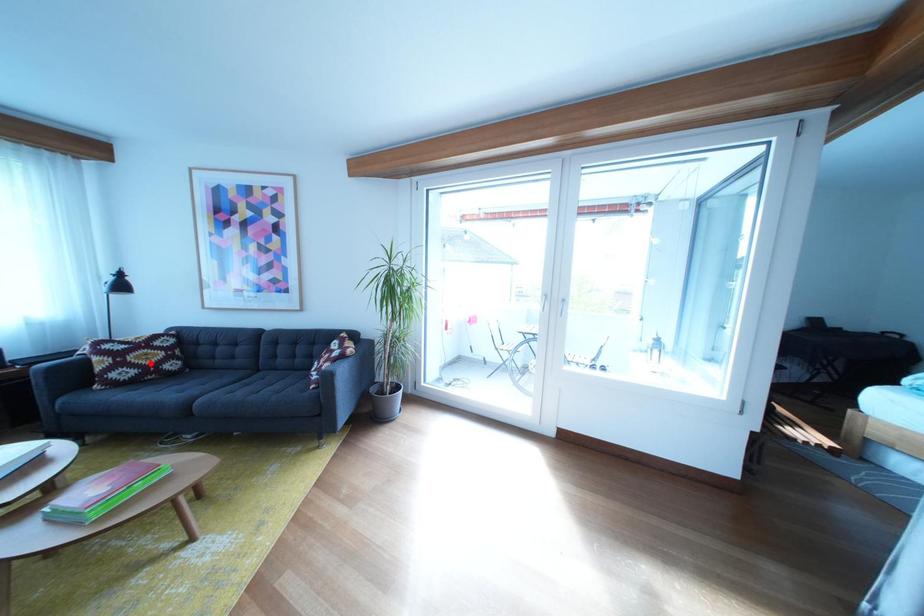
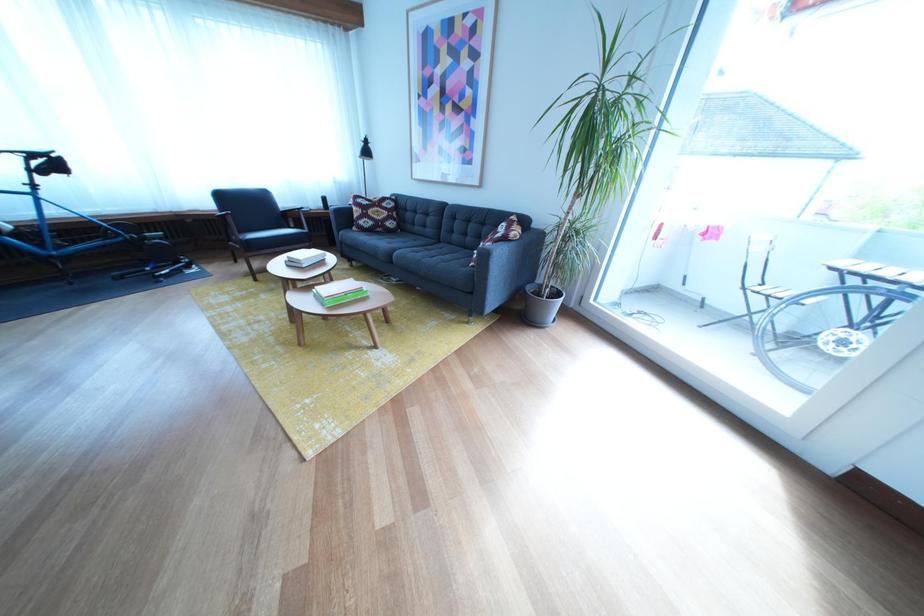
Question: I am providing you with two images of the same scene from different viewpoints. Image1 has a red point marked. In image2, the corresponding 3D location appears at what relative position? Reply with the corresponding letter.

Choices:
 (A) Closer
 (B) Farther

Answer: (A)